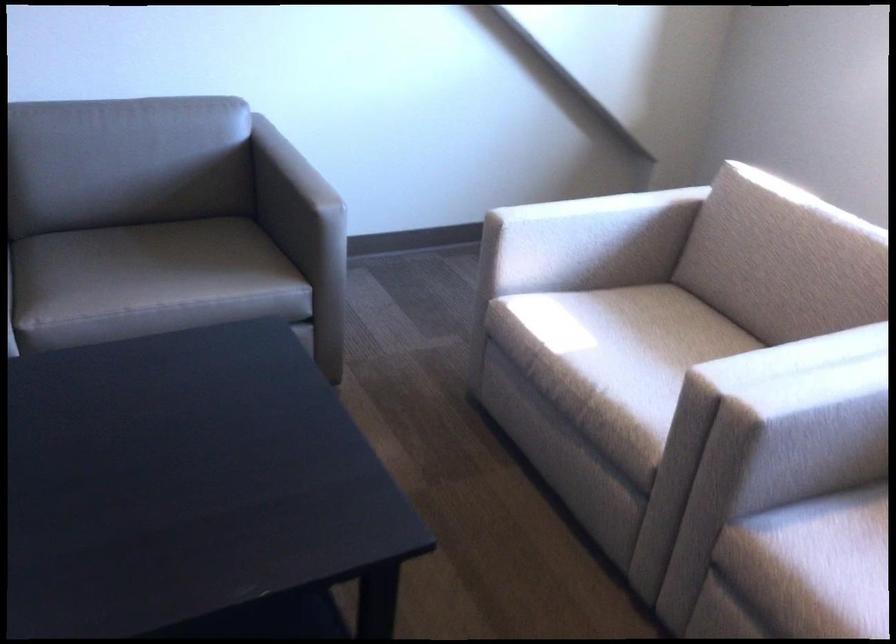
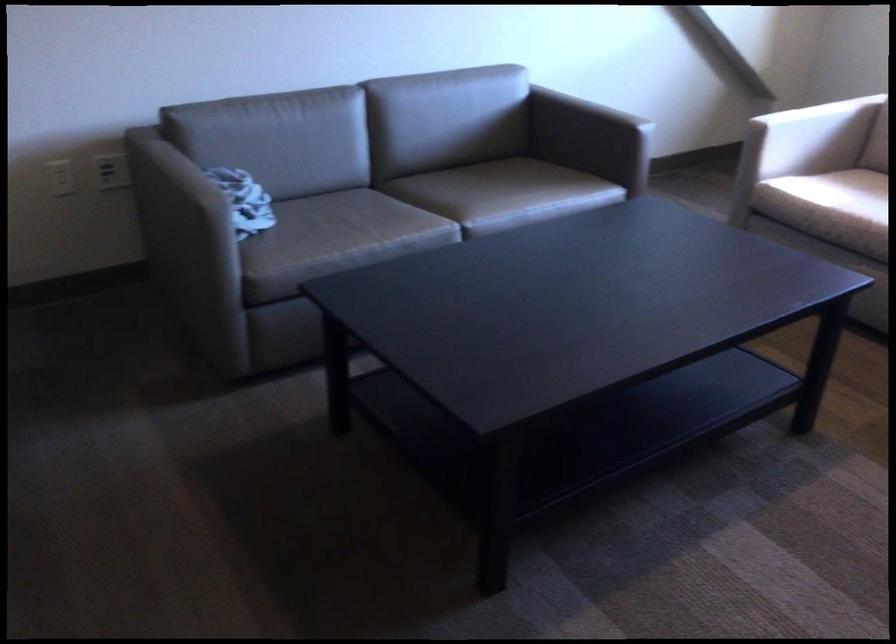
The point at (x=106, y=285) is marked in the first image. Where is the corresponding point in the second image?

(489, 194)